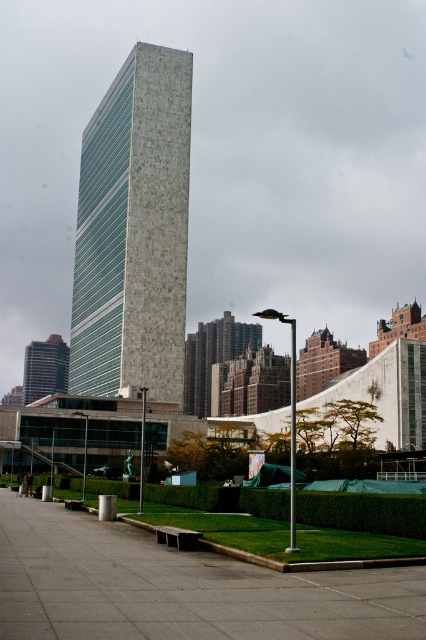
Question: Can you confirm if white stone tower at center is thinner than dark gray stone building at lower left?

Choices:
 (A) yes
 (B) no

Answer: (B)

Question: Which object is closer to the camera taking this photo?

Choices:
 (A) white stone tower at center
 (B) dark gray stone building at lower left

Answer: (A)

Question: Which point is farther from the camera taking this photo?

Choices:
 (A) (63, 371)
 (B) (175, 250)
 (C) (0, 508)

Answer: (A)

Question: Is white stone tower at center thinner than dark gray stone building at lower left?

Choices:
 (A) no
 (B) yes

Answer: (A)

Question: Based on their relative distances, which object is farther from the white stone tower at center?

Choices:
 (A) dark gray stone building at lower left
 (B) gray concrete pavement at lower center

Answer: (A)

Question: Is gray concrete pavement at lower center to the left of dark gray stone building at lower left from the viewer's perspective?

Choices:
 (A) no
 (B) yes

Answer: (A)